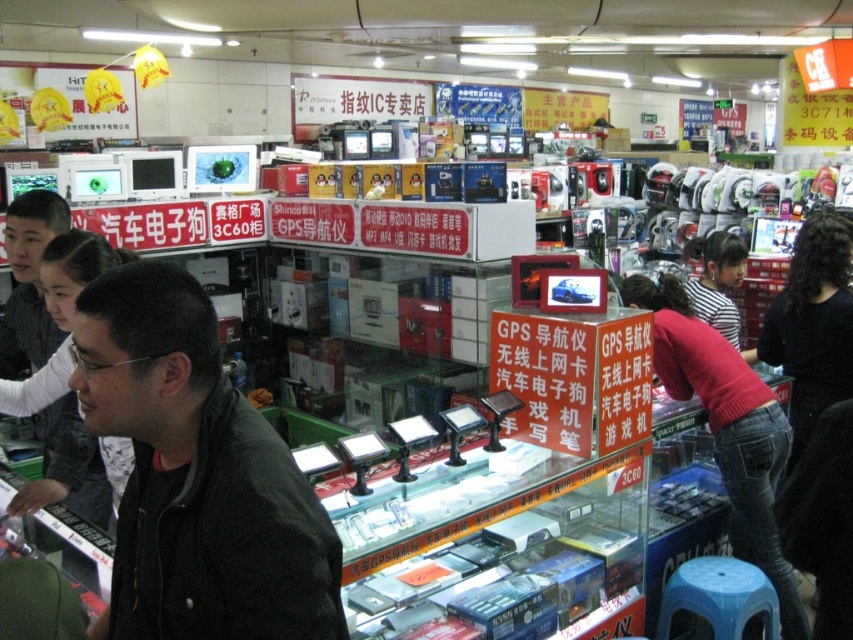
Question: Which of the following is the closest to the observer?

Choices:
 (A) (769, 422)
 (B) (850, 323)

Answer: (A)

Question: Among these points, which one is farthest from the camera?

Choices:
 (A) (724, 337)
 (B) (107, 442)

Answer: (A)

Question: Does black matte shirt at right have a smaller size compared to black matte jacket at left?

Choices:
 (A) yes
 (B) no

Answer: (A)

Question: Can you confirm if black matte jacket at lower left is positioned to the left of red sweater at lower right?

Choices:
 (A) yes
 (B) no

Answer: (A)

Question: In this image, where is black matte shirt at right located relative to striped shirt at center?

Choices:
 (A) above
 (B) below

Answer: (B)

Question: Estimate the real-world distances between objects in this image. Which object is farther from the black matte jacket at lower left?

Choices:
 (A) black matte jacket at left
 (B) striped shirt at center

Answer: (B)